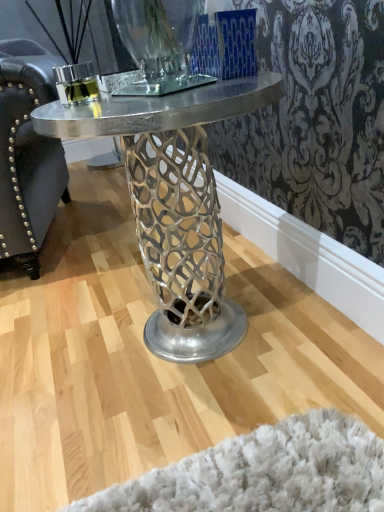
Locate an element on the screen. The height and width of the screenshot is (512, 384). metallic silver table at center is located at coordinates (174, 203).

What do you see at coordinates (174, 203) in the screenshot? The width and height of the screenshot is (384, 512). I see `metallic silver table at center` at bounding box center [174, 203].

The width and height of the screenshot is (384, 512). I want to click on metallic silver table at center, so click(x=174, y=203).